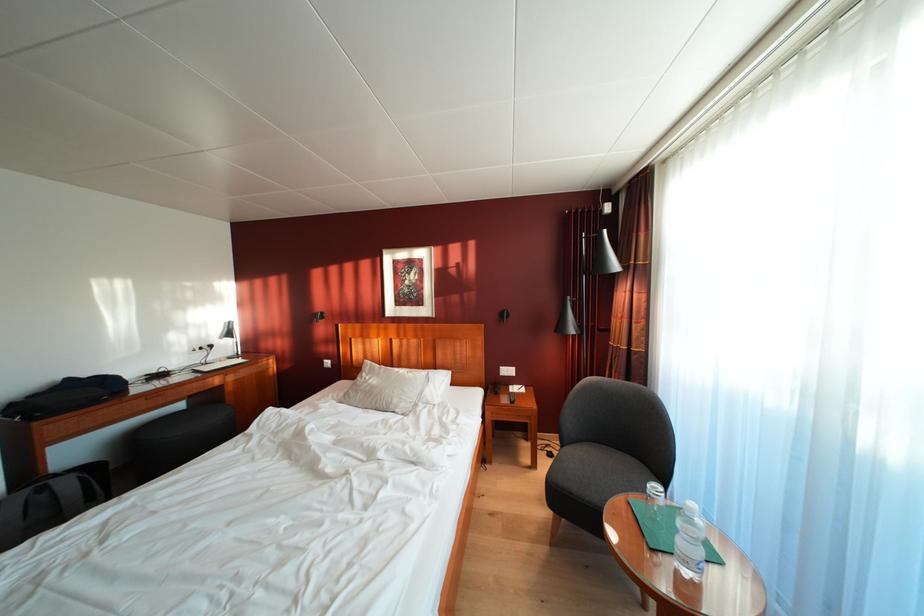
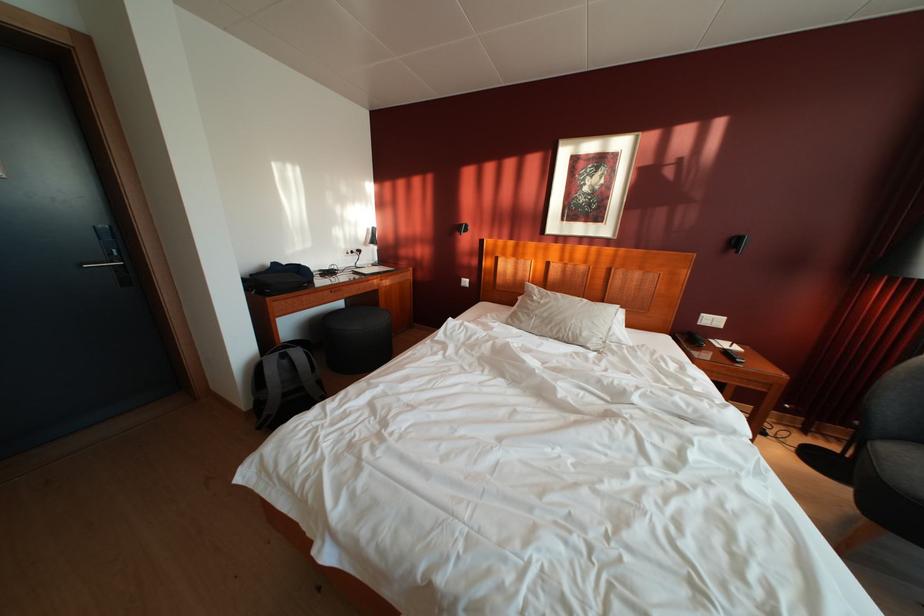
The point at (x=79, y=386) is marked in the first image. Where is the corresponding point in the second image?

(284, 270)